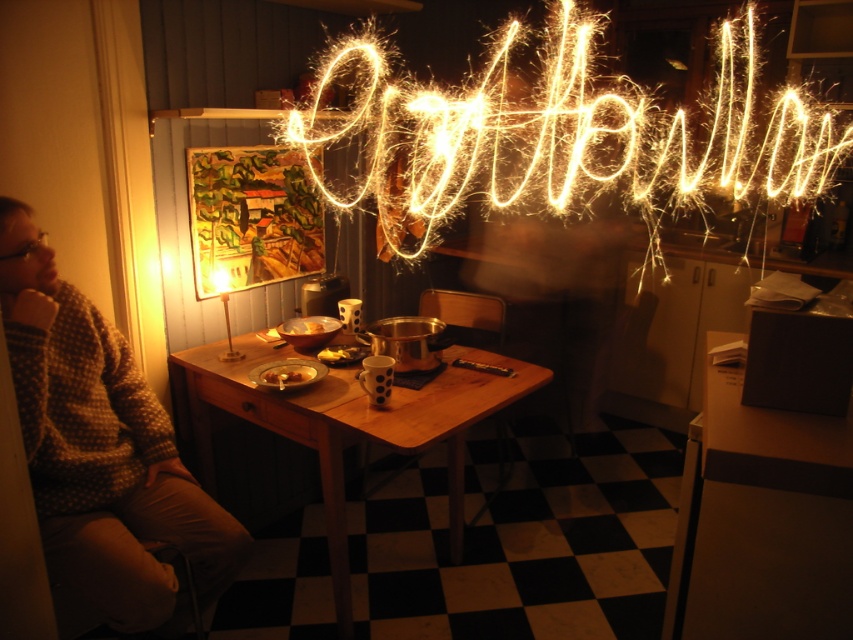
You are planning to place a new decorative item on the wooden table at center. Considering the size of the smooth brown bread at table center, will the table have enough space for the item?

The wooden table at center is larger than the smooth brown bread at table center, so there should be enough space for the decorative item.

You are a guest in this dining area and want to hang a picture frame that is 1 meter tall on the wall. The sparkling neon sign at upper center and the knitted sweater at left are already present. Which object should you avoid placing the frame next to to ensure it doesn

The sparkling neon sign at upper center is taller than the knitted sweater at left. Since the picture frame is 1 meter tall, placing it next to the taller sparkling neon sign at upper center might cause it to be obscured or require more space. To avoid this, you should avoid placing the frame next to the sparkling neon sign at upper center.